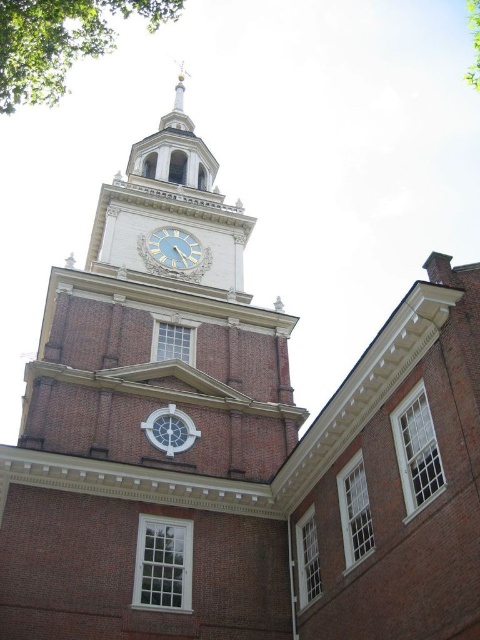
You are an architect assessing the symmetry of the building. Given the presence of the green leafy tree at upper left and the green leafy tree at upper right, which tree might disrupt the building facade symmetry and why?

The green leafy tree at upper left might disrupt the building facade symmetry because it has a larger size compared to the green leafy tree at upper right.